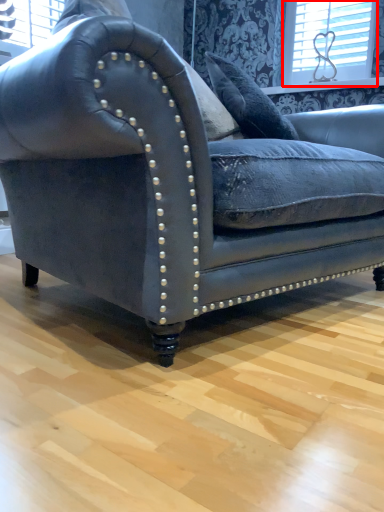
Question: From the image's perspective, where is window (annotated by the red box) located relative to studio couch?

Choices:
 (A) below
 (B) above

Answer: (B)